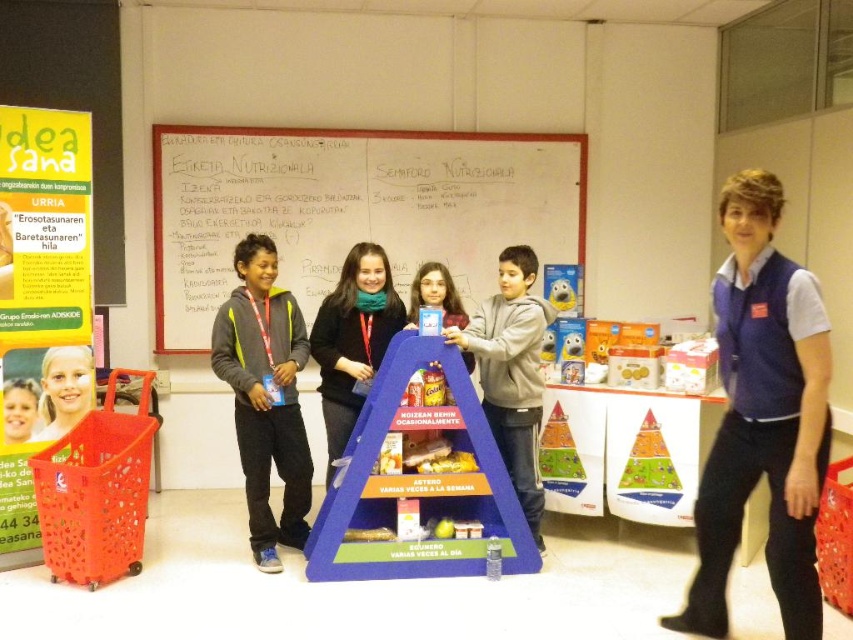
Question: Can you confirm if blonde hair at center is smaller than plush yellow bear at center?

Choices:
 (A) yes
 (B) no

Answer: (B)

Question: Is matte gray hoodie at center above plush yellow bear at center?

Choices:
 (A) yes
 (B) no

Answer: (B)

Question: Which point is closer to the camera?

Choices:
 (A) gray fleece hoodie at center
 (B) plush yellow bear at center

Answer: (A)

Question: Among these objects, which one is farthest from the camera?

Choices:
 (A) blue cardboard pyramid at center
 (B) matte gray hoodie at center

Answer: (B)

Question: Does blue cardboard pyramid at center appear under matte gray hoodie at center?

Choices:
 (A) no
 (B) yes

Answer: (B)

Question: Which object is farther from the camera taking this photo?

Choices:
 (A) blue cardboard pyramid at center
 (B) gray fleece hoodie at center

Answer: (B)